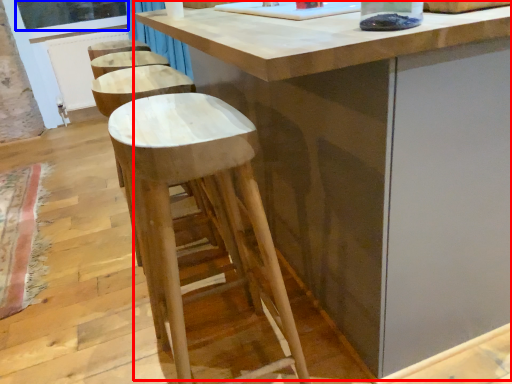
Question: Which point is closer to the camera, table (highlighted by a red box) or window screen (highlighted by a blue box)?

Choices:
 (A) table
 (B) window screen

Answer: (A)